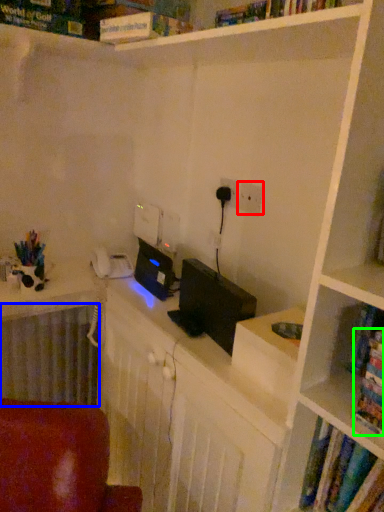
Question: Based on their relative distances, which object is farther from electric outlet (highlighted by a red box)? Choose from radiator (highlighted by a blue box) and book (highlighted by a green box).

Choices:
 (A) radiator
 (B) book

Answer: (A)